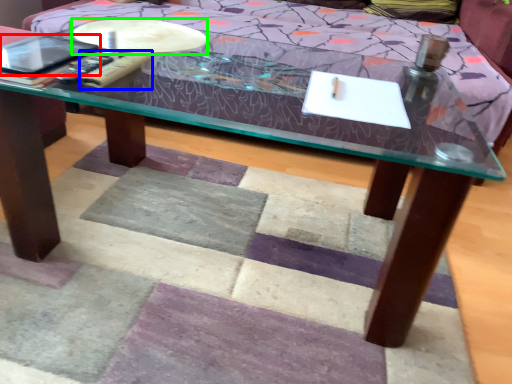
Question: Which is farther away from tablet computer (highlighted by a red box)? remote (highlighted by a blue box) or round table (highlighted by a green box)?

Choices:
 (A) remote
 (B) round table

Answer: (B)